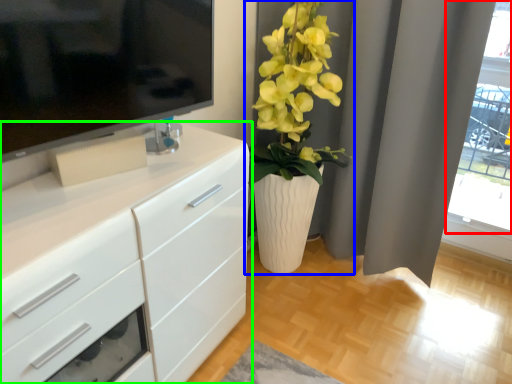
Question: Considering the real-world distances, which object is closest to glass door (highlighted by a red box)? houseplant (highlighted by a blue box) or chest of drawers (highlighted by a green box).

Choices:
 (A) houseplant
 (B) chest of drawers

Answer: (A)